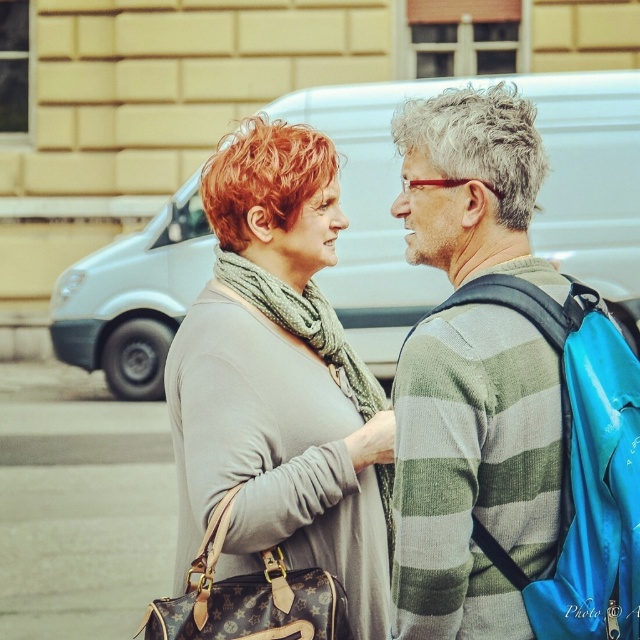
Question: Can you confirm if striped sweater at center is positioned to the left of matte gray scarf at center?

Choices:
 (A) yes
 (B) no

Answer: (B)

Question: Which object is closer to the camera taking this photo?

Choices:
 (A) striped sweater at center
 (B) matte gray scarf at center

Answer: (A)

Question: Can you confirm if striped sweater at center is positioned to the right of matte gray scarf at center?

Choices:
 (A) no
 (B) yes

Answer: (B)

Question: Considering the relative positions of striped sweater at center and matte gray scarf at center in the image provided, where is striped sweater at center located with respect to matte gray scarf at center?

Choices:
 (A) above
 (B) below

Answer: (A)

Question: Among these points, which one is farthest from the camera?

Choices:
 (A) (300, 506)
 (B) (401, 477)

Answer: (A)

Question: Among these objects, which one is farthest from the camera?

Choices:
 (A) striped sweater at center
 (B) matte gray scarf at center

Answer: (B)